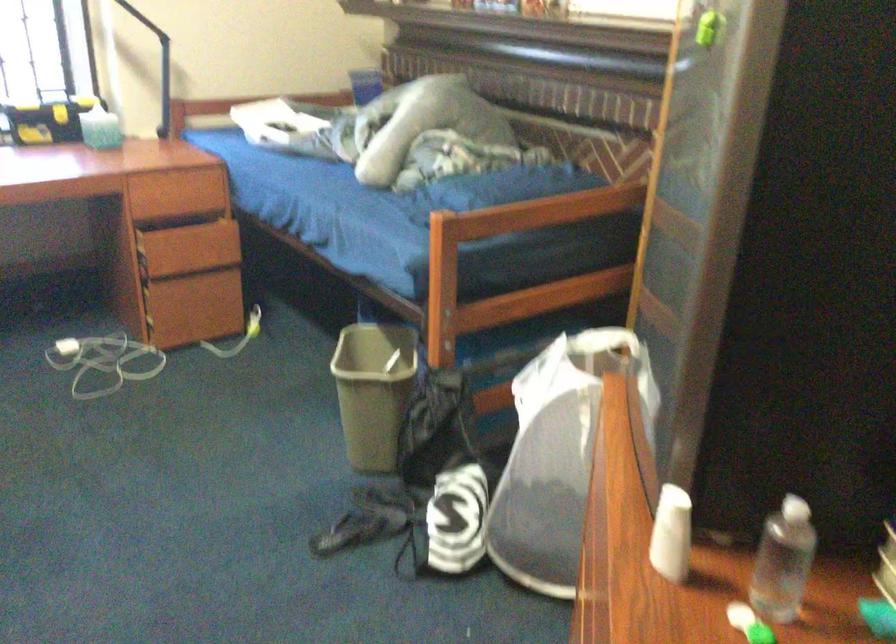
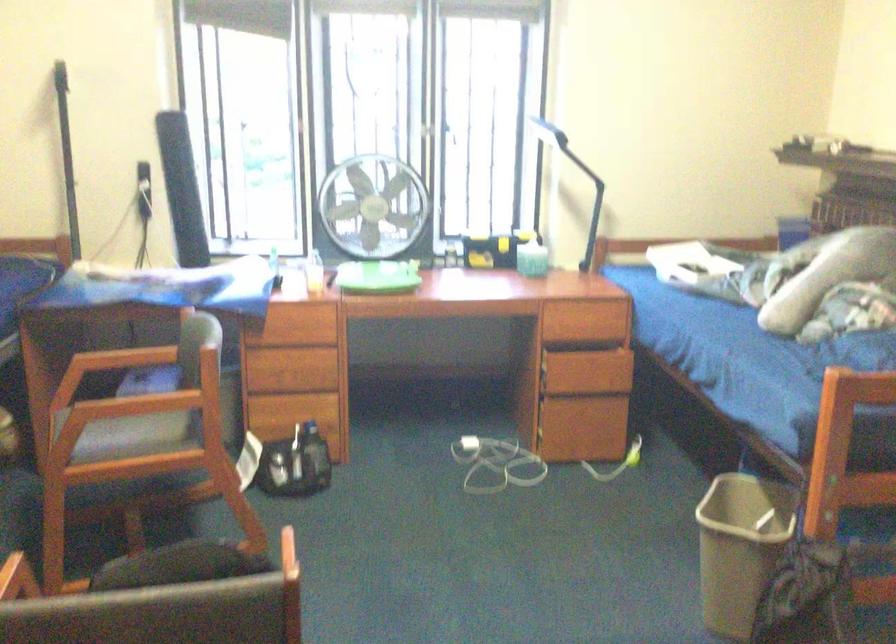
Find the pixel in the second image that matches (x=207, y=250) in the first image.

(601, 375)